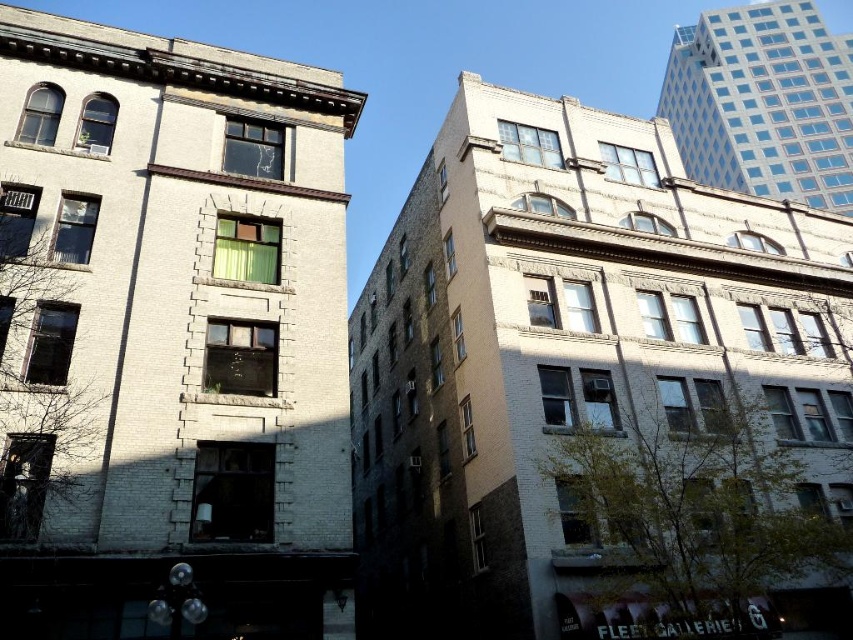
You are standing on the sidewalk in front of these buildings and want to take a photo that includes both the white brick building at left and the white brick building at center. Which building should you focus on to ensure both are in the frame without moving your camera position?

You should focus on the white brick building at center because it is larger and will help frame both buildings effectively while keeping them in the shot.

You are standing on the street and see two points marked in the image. The first point is at coordinates point [158,540] and the second is at point [753,330]. Based on their positions, which point is closer to you?

Point [158,540] is in front of point [753,330], so it is closer to you.

You are a delivery person trying to park your 2.5 meter wide delivery van between the white brick building at left and the white brick building at center. Based on the scene, can you fit your van there?

The white brick building at left is thinner than the white brick building at center. However, without knowing the exact distance between them, it is impossible to determine if the 2.5 meter wide van can fit. Please check the actual space available.